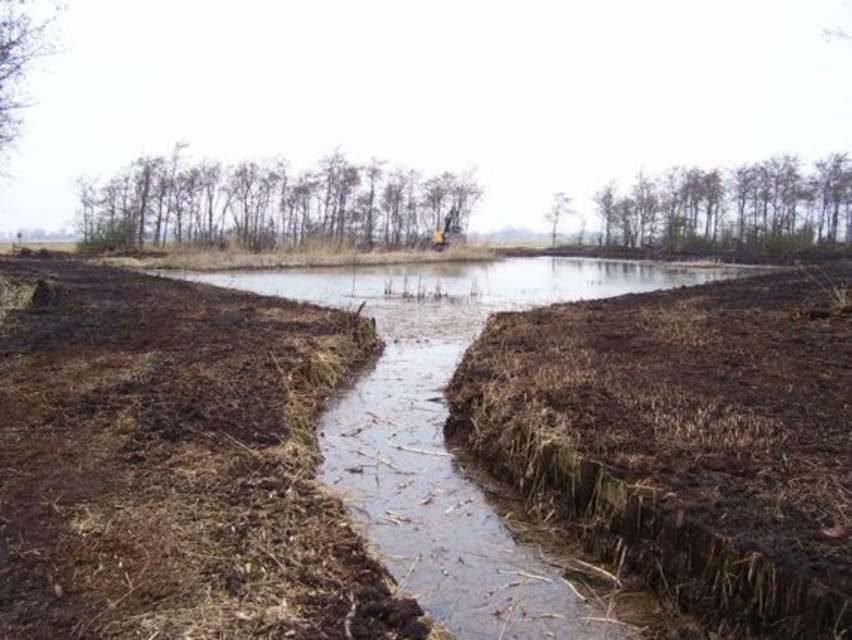
Is point (528, 468) positioned in front of point (494, 282)?

Yes.

In order to click on brown dry grass at center in this screenshot , I will do `click(684, 438)`.

Between point (790, 387) and point (515, 298), which one is positioned in front?

Point (790, 387) is more forward.

This screenshot has width=852, height=640. In order to click on brown dry grass at center in this screenshot , I will do `click(684, 438)`.